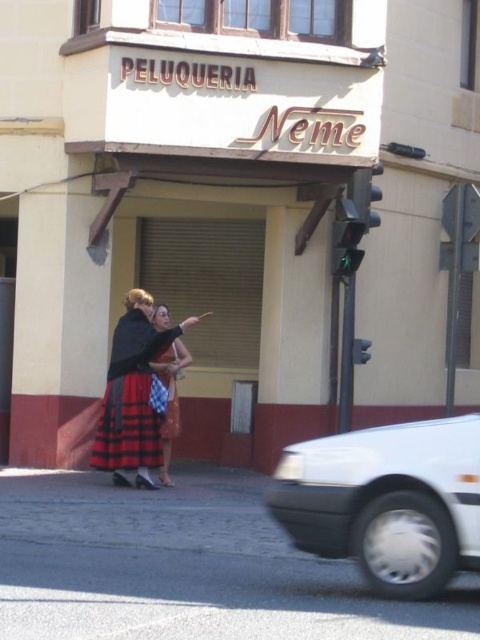
You are a pedestrian standing in the street scene. You see a white matte car at lower right and a red plaid skirt at center. Which object is located more to the right side?

The white matte car at lower right is positioned on the right side of the red plaid skirt at center, so it is more to the right side.